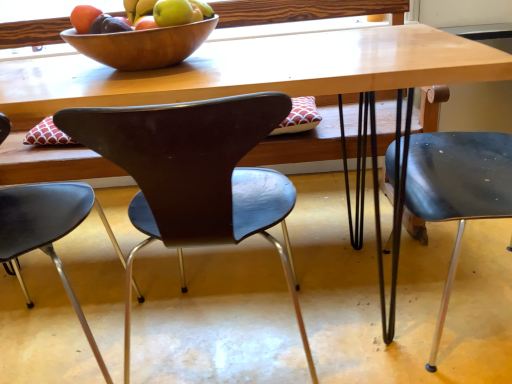
Question: From the image's perspective, is matte brown chair at center, the 2th chair in the right-to-left sequence, positioned above or below wooden bowl at upper center?

Choices:
 (A) below
 (B) above

Answer: (A)

Question: Is point (179, 246) closer or farther from the camera than point (129, 46)?

Choices:
 (A) farther
 (B) closer

Answer: (A)

Question: Which object is positioned farthest from the wooden bowl at upper center?

Choices:
 (A) matte brown chair at center, the 2th chair in the right-to-left sequence
 (B) matte black chair at right, the 3th chair from the left
 (C) matte black chair at center, placed as the 3th chair when sorted from right to left

Answer: (B)

Question: Considering the real-world distances, which object is closest to the wooden bowl at upper center?

Choices:
 (A) matte brown chair at center, the 2th chair in the right-to-left sequence
 (B) matte black chair at center, placed as the 3th chair when sorted from right to left
 (C) matte black chair at right, the 3th chair from the left

Answer: (A)